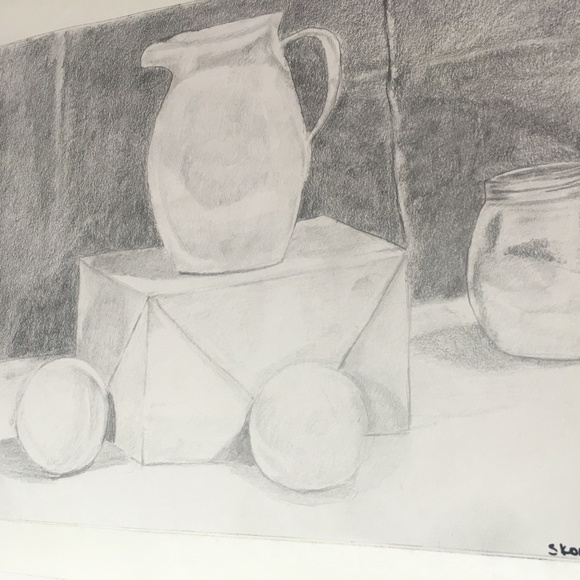
Find the location of a particular element. The height and width of the screenshot is (580, 580). jar is located at coordinates (249, 97).